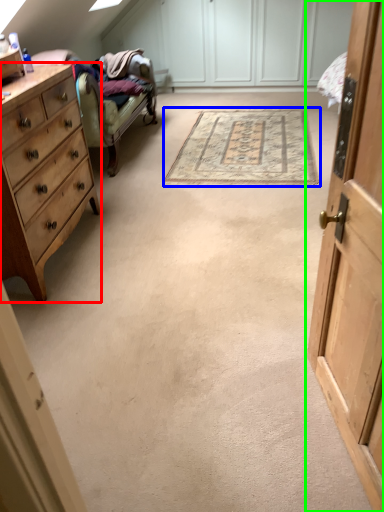
Question: Which object is positioned closest to chest of drawers (highlighted by a red box)? Select from mat (highlighted by a blue box) and cabinetry (highlighted by a green box).

Choices:
 (A) mat
 (B) cabinetry

Answer: (A)